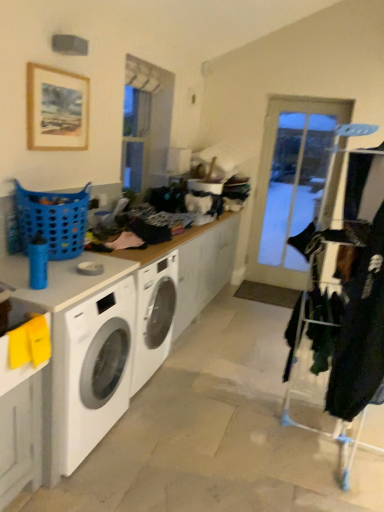
Question: From the image's perspective, is velvet black coat at right located above or below yellow matte sink at lower left?

Choices:
 (A) above
 (B) below

Answer: (B)

Question: Visually, is velvet black coat at right positioned to the left or to the right of yellow matte sink at lower left?

Choices:
 (A) right
 (B) left

Answer: (A)

Question: Estimate the real-world distances between objects in this image. Which object is farther from the yellow matte sink at lower left?

Choices:
 (A) velvet black coat at right
 (B) white glossy washing machine at lower left
 (C) white laminate counter top at center
 (D) metal/textured clothes rack at right
 (E) blue plastic laundry basket at left

Answer: (D)

Question: Which object is the closest to the velvet black coat at right?

Choices:
 (A) metal/textured clothes rack at right
 (B) white laminate counter top at center
 (C) yellow matte sink at lower left
 (D) wooden picture frame at upper left
 (E) blue plastic laundry basket at left

Answer: (A)